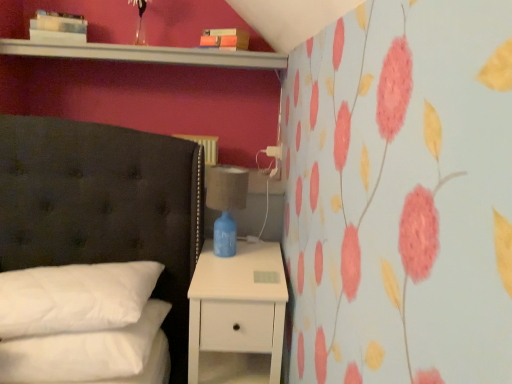
The image size is (512, 384). Find the location of `vacant space in front of blue ceramic lamp at right`. vacant space in front of blue ceramic lamp at right is located at coordinates [247, 269].